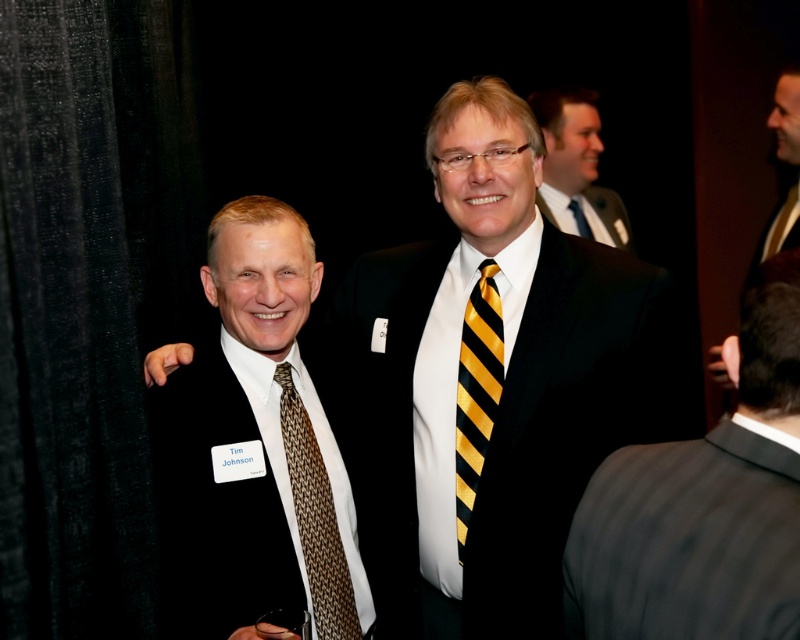
Can you confirm if black suit at upper center is shorter than black silk suit at upper center?

In fact, black suit at upper center may be taller than black silk suit at upper center.

Is point (604, 232) less distant than point (544, 212)?

That is False.

Measure the distance between black suit at upper center and camera.

A distance of 10.96 feet exists between black suit at upper center and camera.

This screenshot has height=640, width=800. Identify the location of black suit at upper center. (576, 168).

Can you confirm if gray striped suit at center is thinner than yellow/black striped tie at center?

No, gray striped suit at center is not thinner than yellow/black striped tie at center.

Is point (745, 307) behind point (474, 476)?

No, it is not.

This screenshot has height=640, width=800. In order to click on gray striped suit at center in this screenshot , I will do `click(704, 502)`.

Can you confirm if black silk suit at center is bigger than brown woven tie at center?

Yes, black silk suit at center is bigger than brown woven tie at center.

Does black silk suit at center appear over brown woven tie at center?

Yes.

Is point (338, 323) positioned in front of point (306, 456)?

No, it is not.

This screenshot has width=800, height=640. What are the coordinates of `black silk suit at center` in the screenshot? It's located at (570, 419).